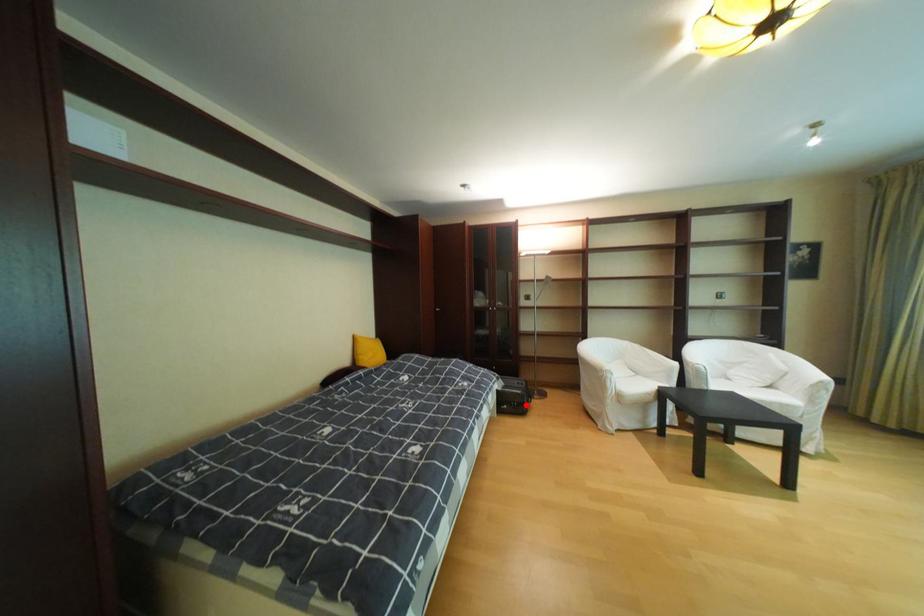
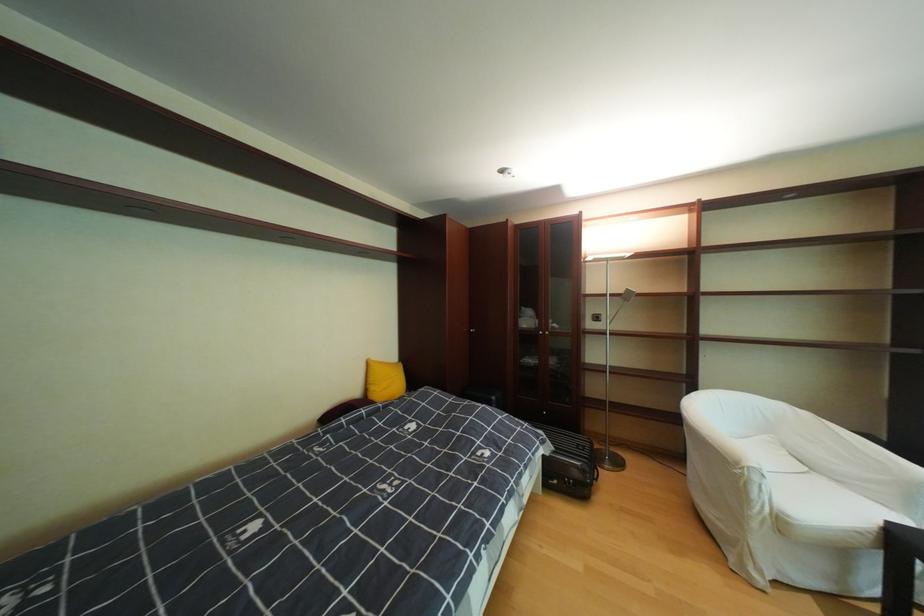
The point at the highlighted location is marked in the first image. Where is the corresponding point in the second image?

(580, 483)